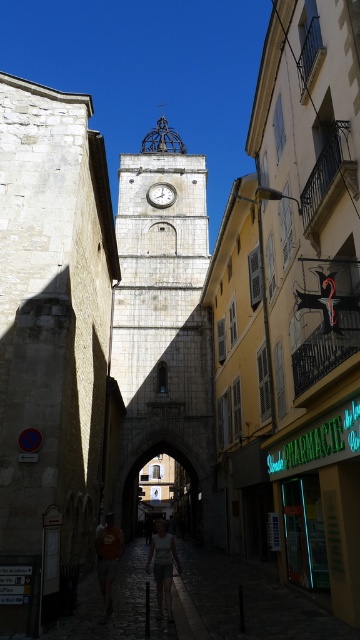
Can you confirm if white cotton shirt at center is taller than orange cotton shirt at lower center?

Indeed, white cotton shirt at center has a greater height compared to orange cotton shirt at lower center.

Who is taller, white cotton shirt at center or orange cotton shirt at lower center?

Standing taller between the two is white cotton shirt at center.

Which is behind, point (168, 620) or point (111, 540)?

Point (111, 540)

In order to click on white cotton shirt at center in this screenshot , I will do `click(163, 566)`.

Does stone clock tower at center have a greater height compared to white cotton shirt at center?

Yes, stone clock tower at center is taller than white cotton shirt at center.

Which is more to the left, stone clock tower at center or white cotton shirt at center?

Positioned to the left is stone clock tower at center.

Describe the element at coordinates (160, 323) in the screenshot. I see `stone clock tower at center` at that location.

You are a GUI agent. You are given a task and a screenshot of the screen. Output one action in this format:
    pyautogui.click(x=<x>, y=<y>)
    Task: Click on the stone clock tower at center
    
    Given the screenshot: What is the action you would take?
    pyautogui.click(x=160, y=323)

Is point (169, 348) more distant than point (108, 614)?

That is True.

Can you confirm if stone clock tower at center is positioned above orange cotton shirt at lower center?

Indeed, stone clock tower at center is positioned over orange cotton shirt at lower center.

Who is more distant from viewer, (158,392) or (111,557)?

Point (158,392)

Locate an element on the screen. stone clock tower at center is located at coordinates (160, 323).